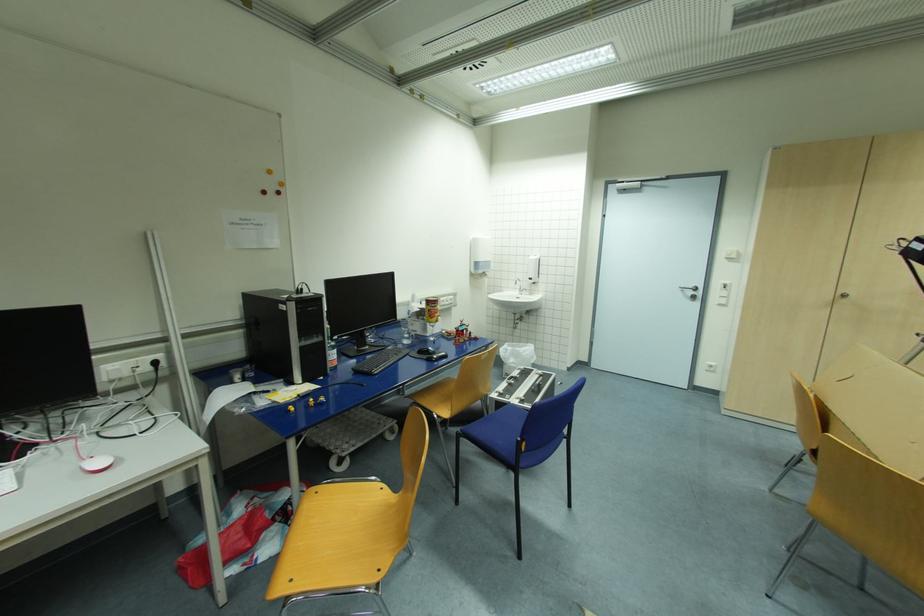
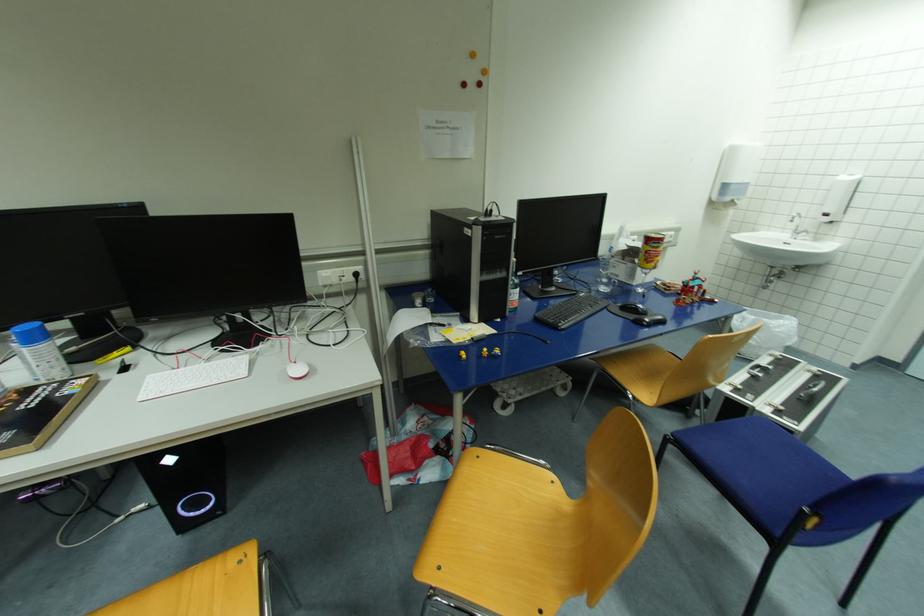
Where in the second image is the point corresponding to point (293, 411) from the first image?

(465, 358)